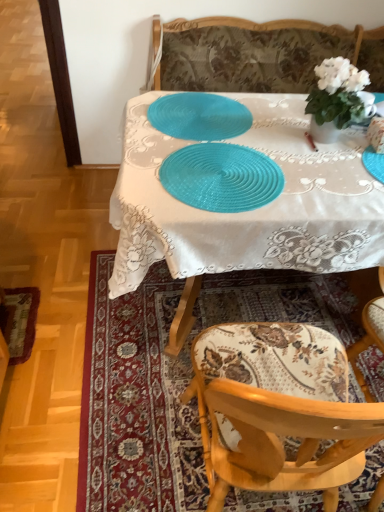
Where is `free space in front of white glossy vase at upper right`? free space in front of white glossy vase at upper right is located at coordinates tap(337, 160).